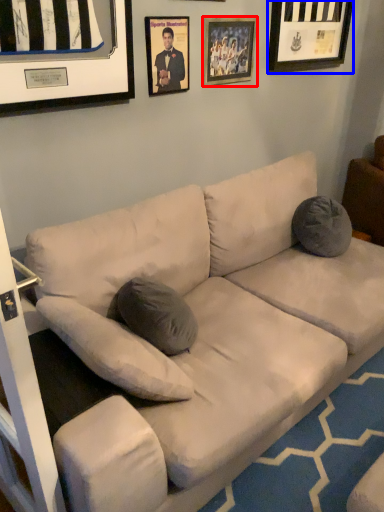
Question: Which object is closer to the camera taking this photo, picture frame (highlighted by a red box) or picture frame (highlighted by a blue box)?

Choices:
 (A) picture frame
 (B) picture frame

Answer: (A)